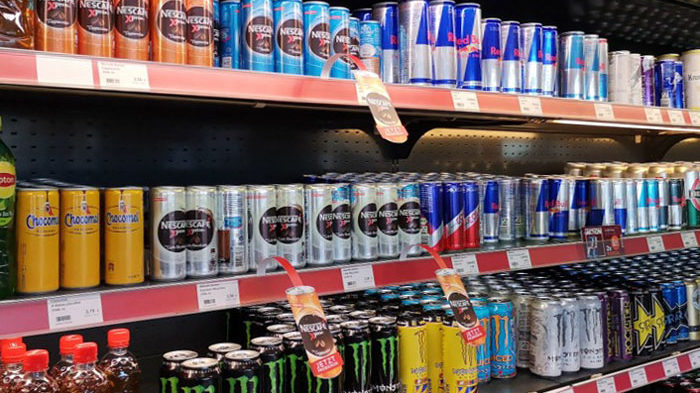
The width and height of the screenshot is (700, 393). In order to click on bottles in this screenshot , I will do `click(119, 358)`, `click(92, 372)`, `click(64, 350)`, `click(46, 383)`, `click(8, 372)`.